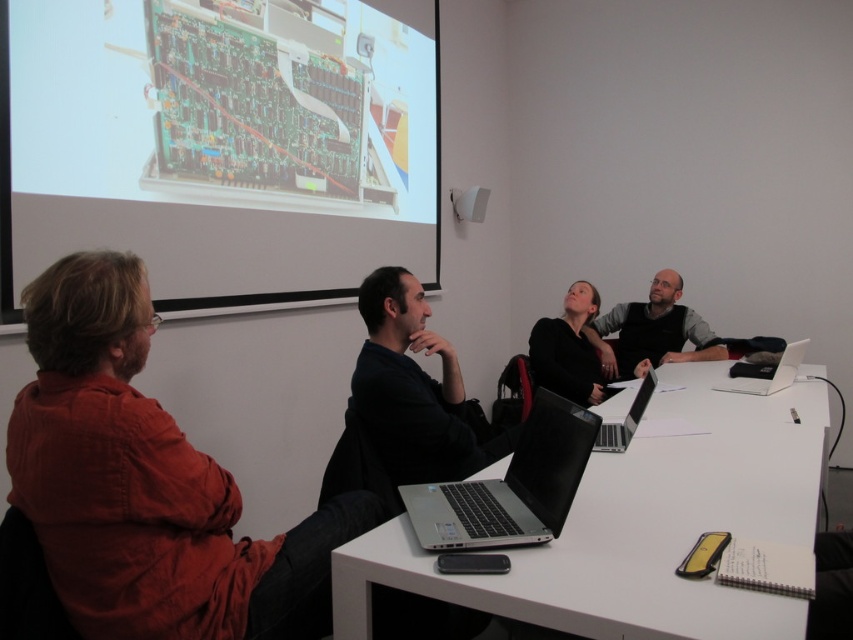
Question: Estimate the real-world distances between objects in this image. Which object is closer to the silver metallic laptop at center?

Choices:
 (A) white glossy laptop at right
 (B) reddish-brown shirt at left
 (C) dark gray sweater at center

Answer: (A)

Question: Does matte black circuit board at upper left have a greater width compared to white glossy table at center?

Choices:
 (A) no
 (B) yes

Answer: (A)

Question: Which of the following is the farthest from the observer?

Choices:
 (A) dark blue shirt at center
 (B) dark gray sweater at center
 (C) sleek silver laptop at center

Answer: (B)

Question: Does matte black circuit board at upper left have a lesser width compared to silver metallic laptop at center?

Choices:
 (A) no
 (B) yes

Answer: (A)

Question: Can you confirm if reddish-brown shirt at left is wider than white glossy table at center?

Choices:
 (A) no
 (B) yes

Answer: (A)

Question: Which object appears farthest from the camera in this image?

Choices:
 (A) dark gray sweater at center
 (B) white glossy laptop at right
 (C) dark blue shirt at center

Answer: (A)